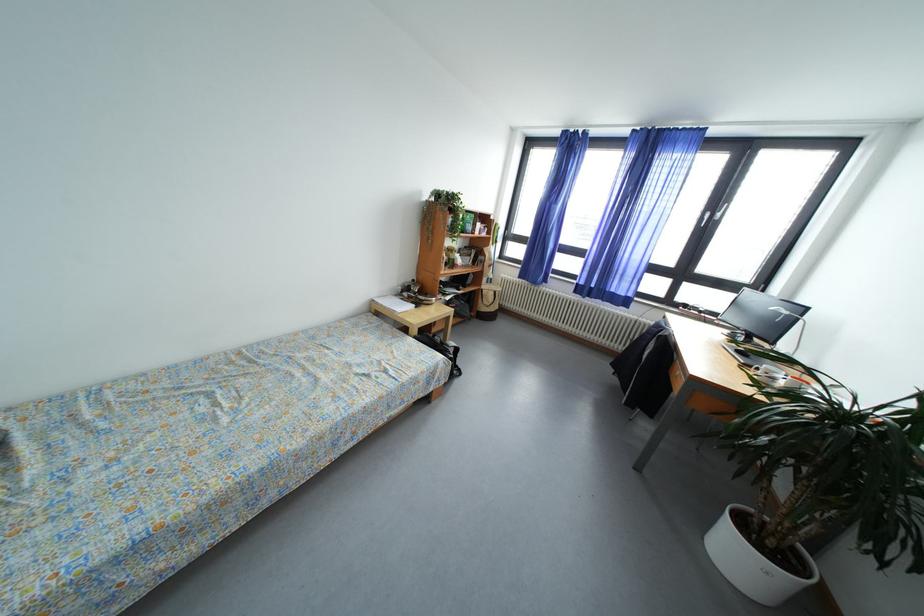
Image resolution: width=924 pixels, height=616 pixels. In order to click on computer keyboard in this screenshot , I will do `click(748, 355)`.